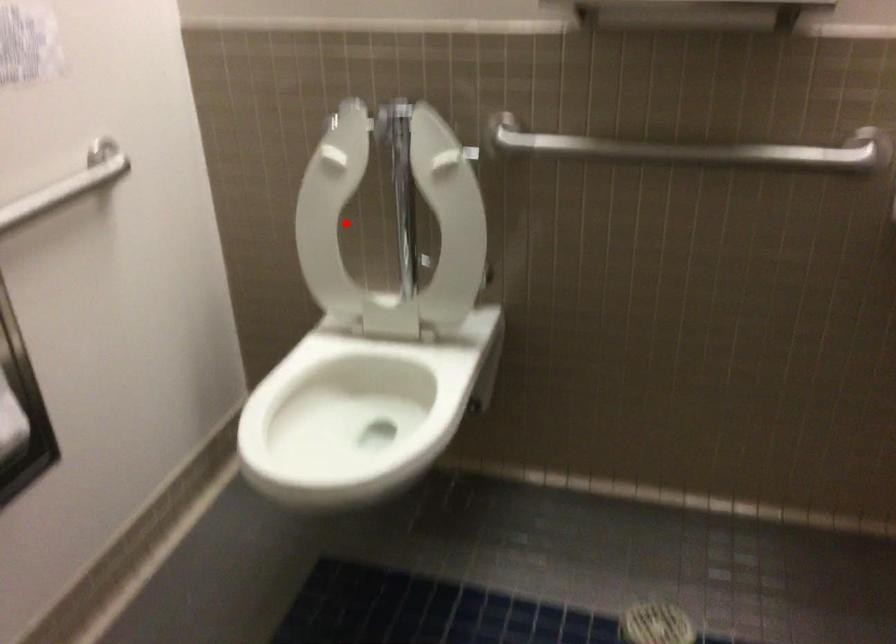
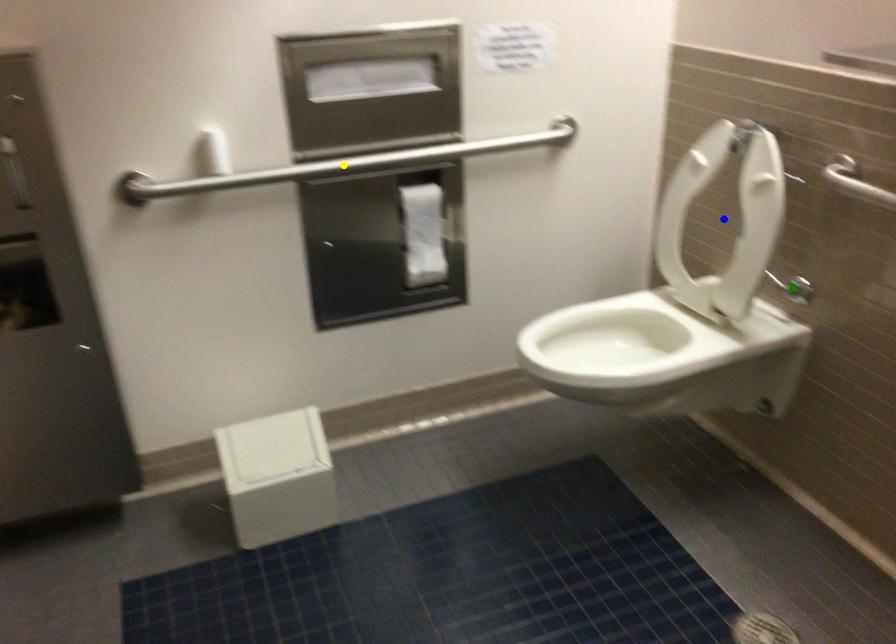
Question: I am providing you with two images of the same scene from different viewpoints. A red point is marked on the first image. You are given multiple points on the second image. Which mark in image 2 goes with the point in image 1?

Choices:
 (A) yellow point
 (B) green point
 (C) blue point

Answer: (C)